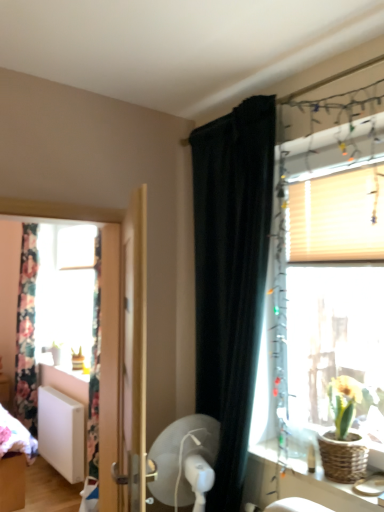
The width and height of the screenshot is (384, 512). I want to click on floral fabric curtain at left, the 1th curtain when ordered from back to front, so [x=27, y=331].

Identify the location of woven wicker vanity at lower right. (322, 489).

Find the location of `white matte radiator at lower left`. white matte radiator at lower left is located at coordinates pyautogui.click(x=61, y=433).

The height and width of the screenshot is (512, 384). Describe the element at coordinates (231, 276) in the screenshot. I see `black velvet curtain at upper center, the 2th curtain viewed from the back` at that location.

Measure the distance between point (243, 277) and camera.

Point (243, 277) is 1.92 meters from camera.

You are a GUI agent. You are given a task and a screenshot of the screen. Output one action in this format:
    pyautogui.click(x=<x>, y=<y>)
    Task: Click on the floral fabric curtain at left, the 1th curtain when ordered from back to front
    This screenshot has height=512, width=384.
    Given the screenshot: What is the action you would take?
    pyautogui.click(x=27, y=331)

Considering the relative sizes of woven wicker vanity at lower right and white matte radiator at lower left in the image provided, is woven wicker vanity at lower right wider than white matte radiator at lower left?

Correct, the width of woven wicker vanity at lower right exceeds that of white matte radiator at lower left.

From a real-world perspective, is woven wicker vanity at lower right above or below white matte radiator at lower left?

Result: From a real-world perspective, woven wicker vanity at lower right is physically above white matte radiator at lower left.

From the image's perspective, is woven wicker vanity at lower right located above or below white matte radiator at lower left?

Based on their image positions, woven wicker vanity at lower right is located above white matte radiator at lower left.

Which of these two, woven wicker vanity at lower right or white matte radiator at lower left, stands shorter?

woven wicker vanity at lower right.

Which object is closer to the camera, wooden door at center or black velvet curtain at upper center, the first curtain positioned from the right?

wooden door at center.

How far apart are wooden door at center and black velvet curtain at upper center, which appears as the second curtain when viewed from the left?

The distance of wooden door at center from black velvet curtain at upper center, which appears as the second curtain when viewed from the left, is 18.15 inches.

What's the angular difference between wooden door at center and black velvet curtain at upper center, the first curtain positioned from the right,'s facing directions?

26.3 degrees.

Is wooden door at center looking in the opposite direction of black velvet curtain at upper center, which appears as the second curtain when viewed from the left?

Absolutely, wooden door at center is directed away from black velvet curtain at upper center, which appears as the second curtain when viewed from the left.

Considering the sizes of objects white matte radiator at lower left and woven wicker vanity at lower right in the image provided, who is bigger, white matte radiator at lower left or woven wicker vanity at lower right?

white matte radiator at lower left is bigger.

What's the angular difference between white matte radiator at lower left and woven wicker vanity at lower right's facing directions?

The angle between the facing direction of white matte radiator at lower left and the facing direction of woven wicker vanity at lower right is 0.635 degrees.

Does point (55, 420) appear closer or farther from the camera than point (270, 466)?

Point (55, 420) is farther from the camera than point (270, 466).

In the scene shown: Could you tell me if white matte radiator at lower left is facing woven wicker vanity at lower right?

No, white matte radiator at lower left is not turned towards woven wicker vanity at lower right.

Between woven wicker vanity at lower right and white matte blind at upper right, which one has less height?

woven wicker vanity at lower right.

Is woven wicker vanity at lower right bigger than white matte blind at upper right?

Actually, woven wicker vanity at lower right might be smaller than white matte blind at upper right.

Which of these two, woven wicker vanity at lower right or white matte blind at upper right, is thinner?

white matte blind at upper right is thinner.

Identify the location of vanity that appears below the white matte blind at upper right (from a real-world perspective). (322, 489).

Considering the relative sizes of floral fabric curtain at left, the 1th curtain when ordered from back to front, and translucent wood window at right in the image provided, is floral fabric curtain at left, the 1th curtain when ordered from back to front, smaller than translucent wood window at right?

Actually, floral fabric curtain at left, the 1th curtain when ordered from back to front, might be larger than translucent wood window at right.

Is floral fabric curtain at left, the 2th curtain when ordered from front to back, not within translucent wood window at right?

floral fabric curtain at left, the 2th curtain when ordered from front to back, is positioned outside translucent wood window at right.

From a real-world perspective, is floral fabric curtain at left, the 1th curtain when ordered from back to front, above or below translucent wood window at right?

floral fabric curtain at left, the 1th curtain when ordered from back to front, is below translucent wood window at right.

Does floral fabric curtain at left, the first curtain positioned from the left, have a lesser width compared to translucent wood window at right?

No.

In the image, is woven wicker vanity at lower right positioned in front of or behind white plastic fan at center?

Clearly, woven wicker vanity at lower right is in front of white plastic fan at center.

Based on their positions, is woven wicker vanity at lower right located to the left or right of white plastic fan at center?

woven wicker vanity at lower right is to the right of white plastic fan at center.

In order to click on mechanical fan behind the woven wicker vanity at lower right in this screenshot , I will do `click(185, 461)`.

Is woven wicker vanity at lower right shorter than white plastic fan at center?

Yes.

From a real-world perspective, is black velvet curtain at upper center, which appears as the second curtain when viewed from the left, on wooden door at center?

Correct, in the physical world, black velvet curtain at upper center, which appears as the second curtain when viewed from the left, is higher than wooden door at center.

Is black velvet curtain at upper center, the first curtain positioned from the right, taller or shorter than wooden door at center?

Clearly, black velvet curtain at upper center, the first curtain positioned from the right, is taller compared to wooden door at center.

Considering the sizes of objects black velvet curtain at upper center, the first curtain positioned from the right, and wooden door at center in the image provided, who is smaller, black velvet curtain at upper center, the first curtain positioned from the right, or wooden door at center?

wooden door at center.

Is black velvet curtain at upper center, the 2th curtain viewed from the back, wider or thinner than wooden door at center?

Considering their sizes, black velvet curtain at upper center, the 2th curtain viewed from the back, looks broader than wooden door at center.

Locate an element on the screen. The width and height of the screenshot is (384, 512). radiator on the left of woven wicker vanity at lower right is located at coordinates (61, 433).

The image size is (384, 512). I want to click on door located underneath the black velvet curtain at upper center, which is the first curtain from front to back (from a real-world perspective), so click(x=123, y=352).

Which object lies further to the anchor point wooden door at center, white matte blind at upper right or floral fabric curtain at left, arranged as the 2th curtain when viewed from the right?

The object further to wooden door at center is floral fabric curtain at left, arranged as the 2th curtain when viewed from the right.

Which object lies nearer to the anchor point wooden door at center, green woven basket at right or white matte radiator at lower left?

green woven basket at right lies closer to wooden door at center than the other object.

Looking at the image, which one is located further to floral fabric curtain at left, the 1th curtain when ordered from back to front, translucent wood window at right or black velvet curtain at upper center, the first curtain positioned from the right?

The object further to floral fabric curtain at left, the 1th curtain when ordered from back to front, is translucent wood window at right.

In the scene shown: Considering their positions, is woven wicker vanity at lower right positioned closer to white matte blind at upper right than wooden door at center?

wooden door at center is positioned closer to the anchor white matte blind at upper right.

Considering their positions, is white matte radiator at lower left positioned further to black velvet curtain at upper center, which is the first curtain from front to back, than white matte blind at upper right?

white matte radiator at lower left lies further to black velvet curtain at upper center, which is the first curtain from front to back, than the other object.

Which object lies nearer to the anchor point white matte blind at upper right, wooden door at center or black velvet curtain at upper center, the first curtain positioned from the right?

Among the two, black velvet curtain at upper center, the first curtain positioned from the right, is located nearer to white matte blind at upper right.

When comparing their distances from floral fabric curtain at left, the first curtain positioned from the left, does green woven basket at right or white plastic fan at center seem closer?

white plastic fan at center is positioned closer to the anchor floral fabric curtain at left, the first curtain positioned from the left.

From the image, which object appears to be nearer to translucent wood window at right, wooden door at center or floral fabric curtain at left, arranged as the 2th curtain when viewed from the right?

wooden door at center is positioned closer to the anchor translucent wood window at right.

Locate an element on the screen. This screenshot has width=384, height=512. houseplant between white matte radiator at lower left and white matte blind at upper right is located at coordinates (343, 434).

Find the location of a particular element. This screenshot has width=384, height=512. houseplant between black velvet curtain at upper center, which is the first curtain from front to back, and woven wicker vanity at lower right vertically is located at coordinates (343, 434).

You are a GUI agent. You are given a task and a screenshot of the screen. Output one action in this format:
    pyautogui.click(x=<x>, y=<y>)
    Task: Click on the radiator located between white plastic fan at center and floral fabric curtain at left, arranged as the 2th curtain when viewed from the right, in the depth direction
    This screenshot has width=384, height=512.
    Given the screenshot: What is the action you would take?
    pyautogui.click(x=61, y=433)

Locate an element on the screen. Image resolution: width=384 pixels, height=512 pixels. window between wooden door at center and green woven basket at right in the horizontal direction is located at coordinates (324, 289).